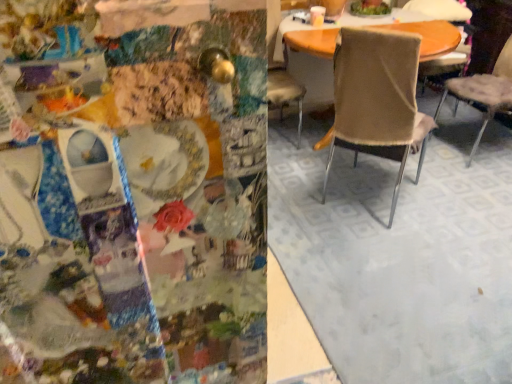
Question: Is beige fabric chair at center, positioned as the second chair in right-to-left order, positioned with its back to beige fabric chair at center, which is the 1th chair in left-to-right order?

Choices:
 (A) no
 (B) yes

Answer: (A)

Question: Is beige fabric chair at center, positioned as the 3th chair in left-to-right order, surrounding beige fabric chair at center, which is the 1th chair in left-to-right order?

Choices:
 (A) no
 (B) yes

Answer: (A)

Question: Could you tell me if beige fabric chair at center, positioned as the second chair in right-to-left order, is facing beige fabric chair at center, which is the 1th chair in left-to-right order?

Choices:
 (A) no
 (B) yes

Answer: (A)

Question: Can you confirm if beige fabric chair at center, positioned as the 3th chair in left-to-right order, is positioned to the right of beige fabric chair at center, which is the 1th chair in left-to-right order?

Choices:
 (A) no
 (B) yes

Answer: (B)

Question: Is beige fabric chair at center, positioned as the second chair in right-to-left order, shorter than beige fabric chair at center, which is the 1th chair in left-to-right order?

Choices:
 (A) yes
 (B) no

Answer: (A)

Question: Considering the positions of beige fabric chair at center, positioned as the second chair in right-to-left order, and beige fabric chair at center, placed as the second chair when sorted from left to right, in the image, is beige fabric chair at center, positioned as the second chair in right-to-left order, wider or thinner than beige fabric chair at center, placed as the second chair when sorted from left to right,?

Choices:
 (A) wide
 (B) thin

Answer: (A)

Question: From a real-world perspective, is beige fabric chair at center, positioned as the second chair in right-to-left order, physically located above or below beige fabric chair at center, arranged as the third chair when viewed from the right?

Choices:
 (A) below
 (B) above

Answer: (A)

Question: Does point (459, 31) appear closer or farther from the camera than point (347, 145)?

Choices:
 (A) closer
 (B) farther

Answer: (B)

Question: Is beige fabric chair at center, positioned as the 3th chair in left-to-right order, bigger or smaller than beige fabric chair at center, placed as the second chair when sorted from left to right?

Choices:
 (A) big
 (B) small

Answer: (B)

Question: Considering the relative positions of beige fabric chair at center, which is counted as the 1th chair, starting from the right, and beige fabric chair at center, positioned as the second chair in right-to-left order, in the image provided, is beige fabric chair at center, which is counted as the 1th chair, starting from the right, to the left or to the right of beige fabric chair at center, positioned as the second chair in right-to-left order,?

Choices:
 (A) left
 (B) right

Answer: (B)

Question: Does point (x=467, y=91) appear closer or farther from the camera than point (x=420, y=11)?

Choices:
 (A) closer
 (B) farther

Answer: (A)

Question: From a real-world perspective, relative to beige fabric chair at center, positioned as the 3th chair in left-to-right order, is beige fabric chair at center, the fourth chair when ordered from left to right, vertically above or below?

Choices:
 (A) above
 (B) below

Answer: (A)

Question: In terms of height, does beige fabric chair at center, which is counted as the 1th chair, starting from the right, look taller or shorter compared to beige fabric chair at center, positioned as the second chair in right-to-left order?

Choices:
 (A) tall
 (B) short

Answer: (A)

Question: Considering the positions of beige fabric chair at center, which is the 1th chair in left-to-right order, and beige fabric chair at center, arranged as the third chair when viewed from the right, in the image, is beige fabric chair at center, which is the 1th chair in left-to-right order, wider or thinner than beige fabric chair at center, arranged as the third chair when viewed from the right,?

Choices:
 (A) wide
 (B) thin

Answer: (A)

Question: Is beige fabric chair at center, marked as the fourth chair in a right-to-left arrangement, inside the boundaries of beige fabric chair at center, arranged as the third chair when viewed from the right, or outside?

Choices:
 (A) inside
 (B) outside

Answer: (B)